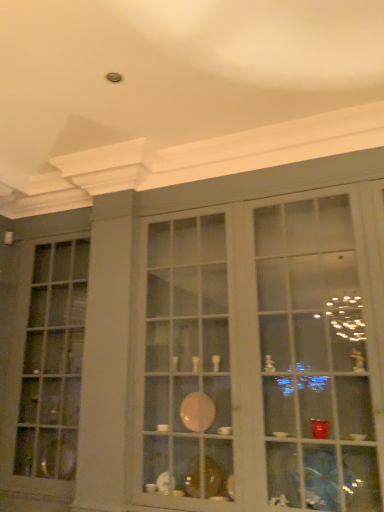
Question: In the image, is matte glass cabinet at center on the left side or the right side of matte glass window at left?

Choices:
 (A) right
 (B) left

Answer: (A)

Question: Is matte glass cabinet at center wider or thinner than matte glass window at left?

Choices:
 (A) thin
 (B) wide

Answer: (B)

Question: From their relative heights in the image, would you say matte glass cabinet at center is taller or shorter than matte glass window at left?

Choices:
 (A) short
 (B) tall

Answer: (A)

Question: Is matte glass window at left spatially inside matte glass cabinet at center, or outside of it?

Choices:
 (A) outside
 (B) inside

Answer: (A)

Question: From a real-world perspective, relative to matte glass cabinet at center, is matte glass window at left vertically above or below?

Choices:
 (A) below
 (B) above

Answer: (A)

Question: Is point pos(64,453) closer or farther from the camera than point pos(190,234)?

Choices:
 (A) farther
 (B) closer

Answer: (B)

Question: From the image's perspective, is matte glass window at left positioned above or below matte glass cabinet at center?

Choices:
 (A) above
 (B) below

Answer: (B)